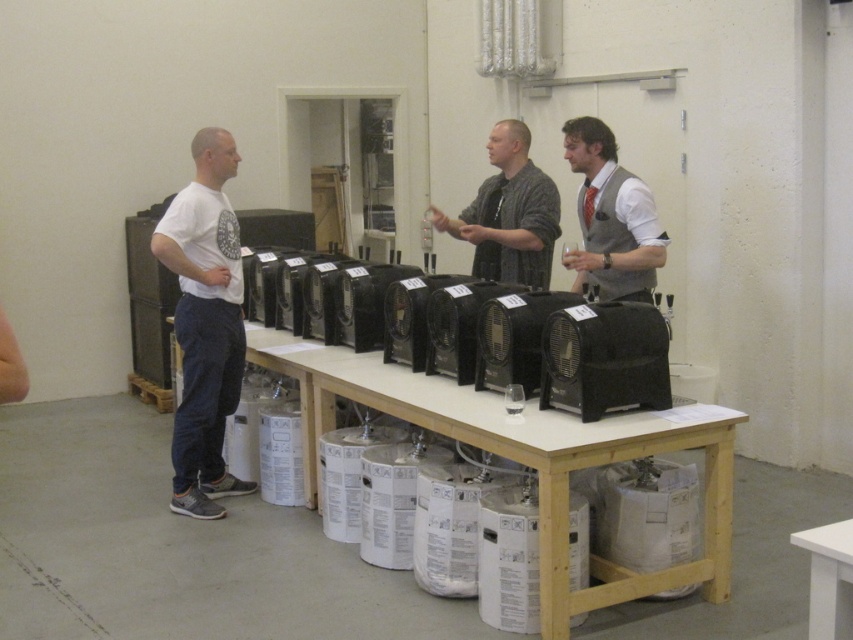
At what (x,y) coordinates should I click in order to perform the action: click on matte gray shirt at center. Please return your answer as a coordinate pair (x, y). The height and width of the screenshot is (640, 853). Looking at the image, I should click on (509, 212).

Who is more distant from viewer, (456, 228) or (811, 573)?

Point (456, 228)

Image resolution: width=853 pixels, height=640 pixels. I want to click on matte gray shirt at center, so click(x=509, y=212).

Image resolution: width=853 pixels, height=640 pixels. I want to click on matte gray shirt at center, so click(x=509, y=212).

The width and height of the screenshot is (853, 640). Identify the location of matte gray vest at center. (611, 218).

Is point (601, 132) positioned before point (521, 188)?

Yes, point (601, 132) is closer to viewer.

Between point (636, 236) and point (492, 237), which one is positioned behind?

Point (492, 237)

You are a GUI agent. You are given a task and a screenshot of the screen. Output one action in this format:
    pyautogui.click(x=<x>, y=<y>)
    Task: Click on the matte gray vest at center
    Image resolution: width=853 pixels, height=640 pixels.
    Given the screenshot: What is the action you would take?
    pyautogui.click(x=611, y=218)

Does wooden table at center have a greater width compared to white t-shirt at left?

Correct, the width of wooden table at center exceeds that of white t-shirt at left.

What do you see at coordinates (525, 458) in the screenshot? The height and width of the screenshot is (640, 853). I see `wooden table at center` at bounding box center [525, 458].

You are a GUI agent. You are given a task and a screenshot of the screen. Output one action in this format:
    pyautogui.click(x=<x>, y=<y>)
    Task: Click on the wooden table at center
    The image size is (853, 640).
    Given the screenshot: What is the action you would take?
    pyautogui.click(x=525, y=458)